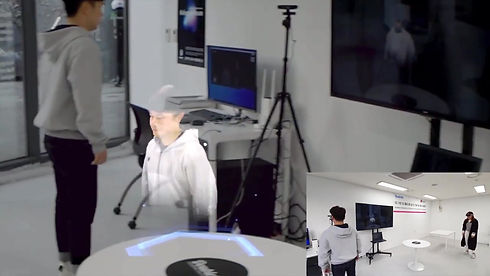
The width and height of the screenshot is (490, 276). Find the location of `keyboard on white desk`. keyboard on white desk is located at coordinates (209, 113).